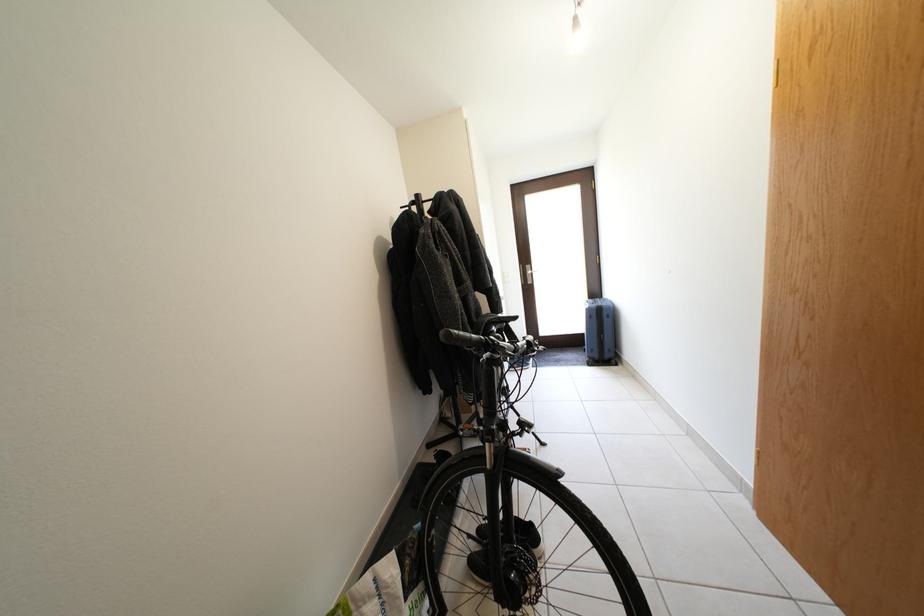
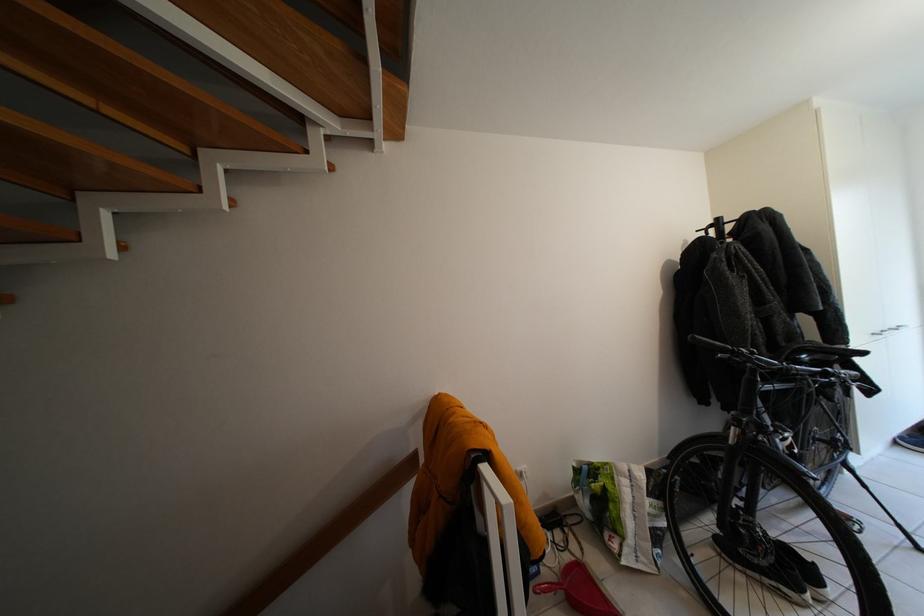
In the second image, find the point that corresponds to (467,342) in the first image.

(710, 345)